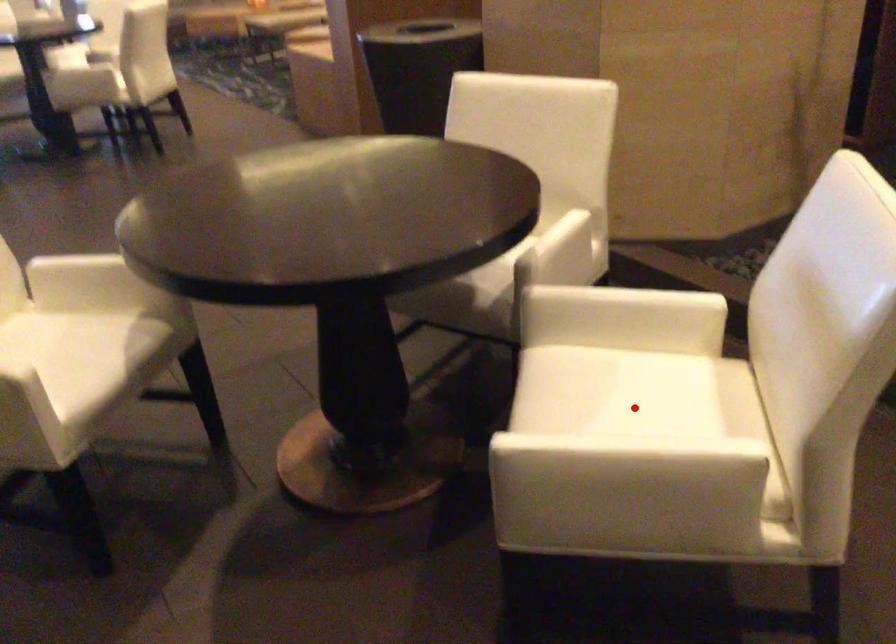
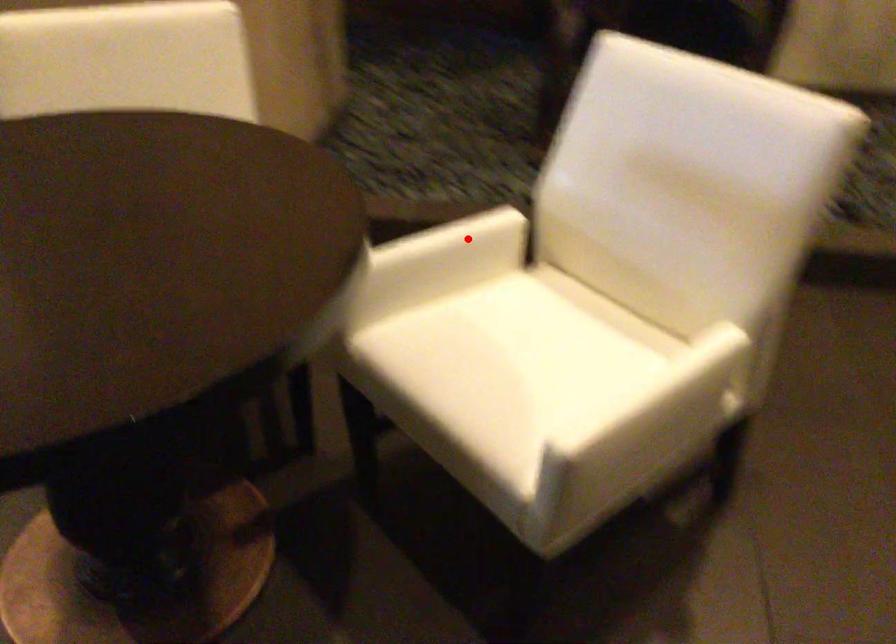
I am providing you with two images of the same scene from different viewpoints. A red point is marked on the first image and another point is marked on the second image. Does the point marked in image1 correspond to the same location as the one in image2?

No